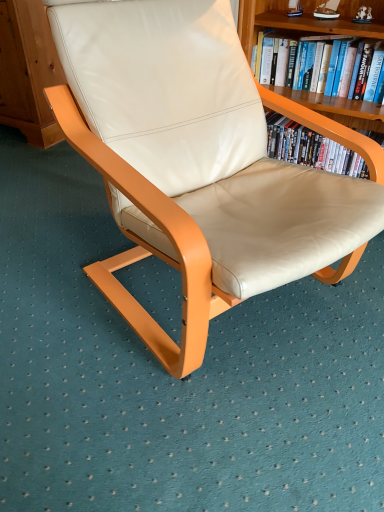
Find the location of a particular element. Image resolution: width=384 pixels, height=512 pixels. beige leather chair at center is located at coordinates (200, 163).

What do you see at coordinates (316, 64) in the screenshot? The width and height of the screenshot is (384, 512). I see `hardcover book at upper right` at bounding box center [316, 64].

Locate an element on the screen. The width and height of the screenshot is (384, 512). wooden bookshelf at upper right is located at coordinates (277, 22).

From a real-world perspective, who is located lower, beige leather chair at center or hardcover book at upper right?

beige leather chair at center, from a real-world perspective.

Is beige leather chair at center spatially inside hardcover book at upper right, or outside of it?

beige leather chair at center lies outside hardcover book at upper right.

What's the angular difference between beige leather chair at center and hardcover book at upper right's facing directions?

They differ by 65 degrees in their facing directions.

From the picture: In terms of size, does beige leather chair at center appear bigger or smaller than hardcover book at upper right?

Considering their sizes, beige leather chair at center takes up more space than hardcover book at upper right.

How many degrees apart are the facing directions of wooden bookshelf at upper right and hardcover book at upper right?

wooden bookshelf at upper right and hardcover book at upper right are facing 0.447 degrees away from each other.

Is wooden bookshelf at upper right facing away from hardcover book at upper right?

That's right, wooden bookshelf at upper right is facing away from hardcover book at upper right.

Based on their positions, is wooden bookshelf at upper right located to the left or right of hardcover book at upper right?

wooden bookshelf at upper right is positioned on hardcover book at upper right's left side.

From the image's perspective, does wooden bookshelf at upper right appear lower than hardcover book at upper right?

Yes, from the image's perspective, wooden bookshelf at upper right is below hardcover book at upper right.

Does point (288, 49) appear closer or farther from the camera than point (361, 35)?

Point (288, 49) is farther from the camera than point (361, 35).

Is hardcover book at upper right not near wooden bookshelf at upper right?

No, hardcover book at upper right is in close proximity to wooden bookshelf at upper right.

Which of these two, hardcover book at upper right or wooden bookshelf at upper right, stands shorter?

hardcover book at upper right is shorter.

At what (x,y) coordinates should I click in order to perform the action: click on bookcase below the hardcover book at upper right (from the image's perspective). Please return your answer as a coordinate pair (x, y). Looking at the image, I should click on (277, 22).

Is the surface of beige leather chair at center in direct contact with wooden bookshelf at upper right?

beige leather chair at center and wooden bookshelf at upper right are clearly separated.

Considering the relative sizes of beige leather chair at center and wooden bookshelf at upper right in the image provided, is beige leather chair at center shorter than wooden bookshelf at upper right?

In fact, beige leather chair at center may be taller than wooden bookshelf at upper right.

Considering the sizes of beige leather chair at center and wooden bookshelf at upper right in the image, is beige leather chair at center wider or thinner than wooden bookshelf at upper right?

Considering their sizes, beige leather chair at center looks broader than wooden bookshelf at upper right.

Looking at this image, is wooden bookshelf at upper right far away from beige leather chair at center?

No, there isn't a large distance between wooden bookshelf at upper right and beige leather chair at center.

Who is more distant, wooden bookshelf at upper right or beige leather chair at center?

wooden bookshelf at upper right is more distant.

Locate an element on the screen. This screenshot has height=512, width=384. bookcase lying on the right of beige leather chair at center is located at coordinates (277, 22).

How different are the orientations of wooden bookshelf at upper right and beige leather chair at center in degrees?

The angular difference between wooden bookshelf at upper right and beige leather chair at center is 65.4 degrees.

Does hardcover book at upper right have a lesser width compared to beige leather chair at center?

Indeed, hardcover book at upper right has a lesser width compared to beige leather chair at center.

Is hardcover book at upper right positioned with its back to beige leather chair at center?

hardcover book at upper right is not turned away from beige leather chair at center.

This screenshot has width=384, height=512. In order to click on chair on the left of the hardcover book at upper right in this screenshot , I will do `click(200, 163)`.

Considering the positions of objects hardcover book at upper right and beige leather chair at center in the image provided, who is in front, hardcover book at upper right or beige leather chair at center?

Positioned in front is beige leather chair at center.

Where is `chair below the hardcover book at upper right (from the image's perspective)`? This screenshot has height=512, width=384. chair below the hardcover book at upper right (from the image's perspective) is located at coordinates (200, 163).

Locate an element on the screen. book behind the wooden bookshelf at upper right is located at coordinates (316, 64).

From the image, which object appears to be farther from wooden bookshelf at upper right, hardcover book at upper right or beige leather chair at center?

Based on the image, beige leather chair at center appears to be further to wooden bookshelf at upper right.

When comparing their distances from hardcover book at upper right, does wooden bookshelf at upper right or beige leather chair at center seem further?

beige leather chair at center is positioned further to the anchor hardcover book at upper right.

Looking at the image, which one is located closer to wooden bookshelf at upper right, beige leather chair at center or hardcover book at upper right?

hardcover book at upper right lies closer to wooden bookshelf at upper right than the other object.

Estimate the real-world distances between objects in this image. Which object is closer to beige leather chair at center, wooden bookshelf at upper right or hardcover book at upper right?

wooden bookshelf at upper right is positioned closer to the anchor beige leather chair at center.

Looking at the image, which one is located closer to beige leather chair at center, hardcover book at upper right or wooden bookshelf at upper right?

The object closer to beige leather chair at center is wooden bookshelf at upper right.

Considering their positions, is beige leather chair at center positioned closer to hardcover book at upper right than wooden bookshelf at upper right?

wooden bookshelf at upper right is closer to hardcover book at upper right.

Find the location of a particular element. Image resolution: width=384 pixels, height=512 pixels. bookcase between beige leather chair at center and hardcover book at upper right along the z-axis is located at coordinates (277, 22).